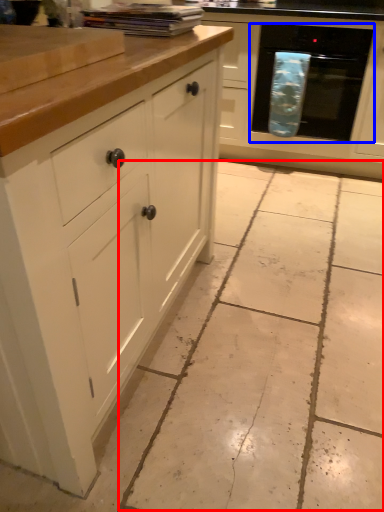
Question: Which object is closer to the camera taking this photo, concrete (highlighted by a red box) or oven (highlighted by a blue box)?

Choices:
 (A) concrete
 (B) oven

Answer: (A)